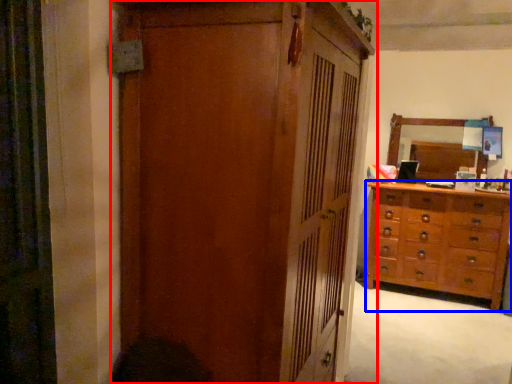
Question: Which of the following is the farthest to the observer, cupboard (highlighted by a red box) or chest of drawers (highlighted by a blue box)?

Choices:
 (A) cupboard
 (B) chest of drawers

Answer: (B)